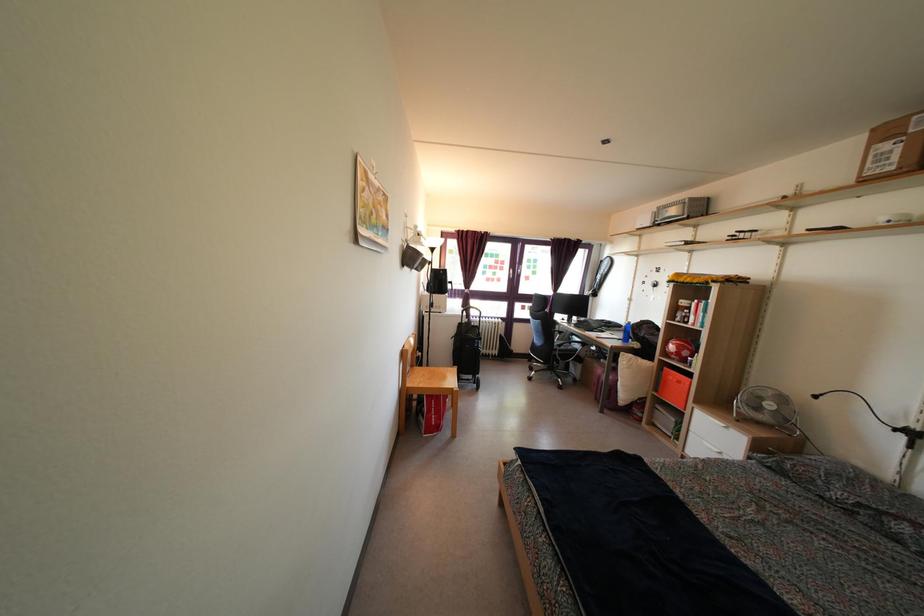
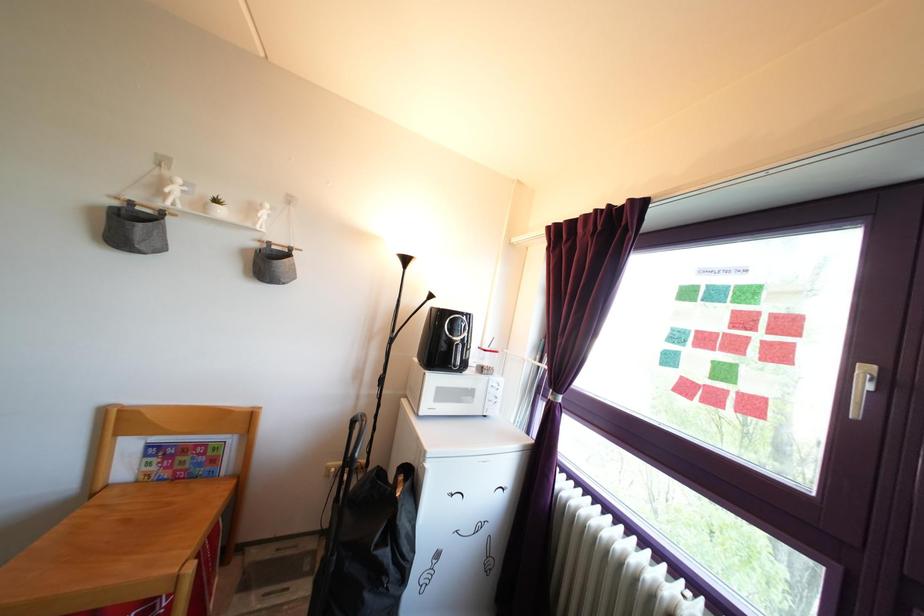
Find the pixel in the second image that matches [495,289] in the first image.

(715, 407)